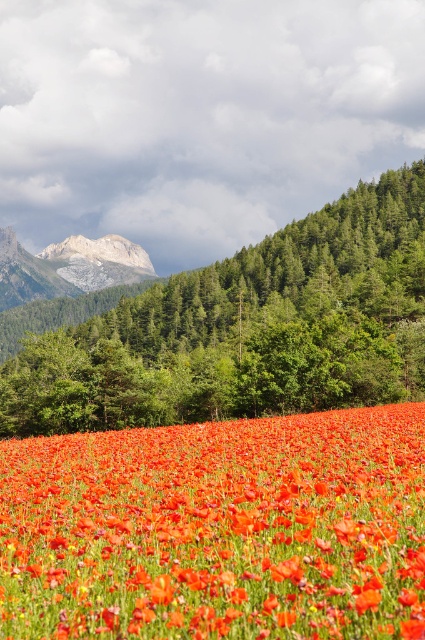
Which is more to the left, green leafy tree at center or gray rocky mountain at upper left?

From the viewer's perspective, gray rocky mountain at upper left appears more on the left side.

Is green leafy tree at center positioned at the back of gray rocky mountain at upper left?

That is False.

Is point (246, 356) farther from viewer compared to point (116, 262)?

No, it is not.

You are a GUI agent. You are given a task and a screenshot of the screen. Output one action in this format:
    pyautogui.click(x=<x>, y=<y>)
    Task: Click on the green leafy tree at center
    
    Given the screenshot: What is the action you would take?
    [248, 330]

Does bright red petals at center have a larger size compared to green leafy tree at center?

Actually, bright red petals at center might be smaller than green leafy tree at center.

Between bright red petals at center and green leafy tree at center, which one appears on the right side from the viewer's perspective?

green leafy tree at center is more to the right.

The width and height of the screenshot is (425, 640). Identify the location of bright red petals at center. (218, 529).

Who is more distant from viewer, [337,512] or [136,264]?

Positioned behind is point [136,264].

Between bright red petals at center and gray rocky mountain at upper left, which one appears on the right side from the viewer's perspective?

Positioned to the right is bright red petals at center.

The width and height of the screenshot is (425, 640). In order to click on bright red petals at center in this screenshot , I will do `click(218, 529)`.

Where is `bright red petals at center`? bright red petals at center is located at coordinates (218, 529).